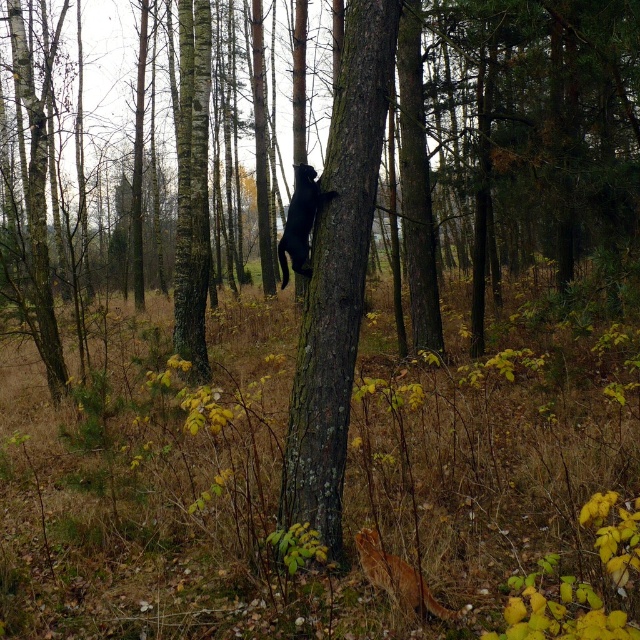
Question: Can you confirm if smooth bark tree at center is positioned to the right of shiny black cat at center?

Choices:
 (A) no
 (B) yes

Answer: (B)

Question: Where is smooth bark tree at center located in relation to shiny black cat at center in the image?

Choices:
 (A) left
 (B) right

Answer: (B)

Question: Which of the following is the farthest from the observer?

Choices:
 (A) shiny black cat at center
 (B) smooth bark tree at center

Answer: (A)

Question: Is smooth bark tree at center behind shiny black cat at center?

Choices:
 (A) no
 (B) yes

Answer: (A)

Question: Which of the following is the closest to the observer?

Choices:
 (A) shiny black cat at center
 (B) smooth bark tree at center

Answer: (B)

Question: Which point is farther to the camera?

Choices:
 (A) (308, 234)
 (B) (355, 124)

Answer: (A)